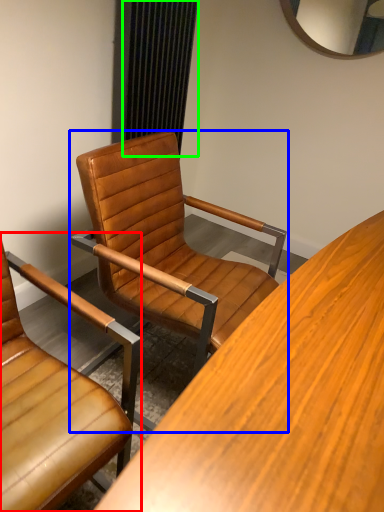
Question: Based on their relative distances, which object is nearer to chair (highlighted by a red box)? Choose from chair (highlighted by a blue box) and curtain (highlighted by a green box).

Choices:
 (A) chair
 (B) curtain

Answer: (A)